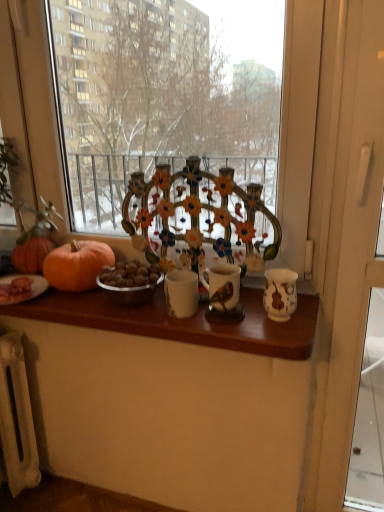
Question: Considering the positions of orange matte pumpkin at left and matte ceramic candle holder at center in the image, is orange matte pumpkin at left taller or shorter than matte ceramic candle holder at center?

Choices:
 (A) short
 (B) tall

Answer: (B)

Question: From the image's perspective, relative to matte ceramic candle holder at center, is orange matte pumpkin at left above or below?

Choices:
 (A) below
 (B) above

Answer: (B)

Question: Estimate the real-world distances between objects in this image. Which object is farther from the matte ceramic candle holder at center?

Choices:
 (A) wooden table at center
 (B) orange matte pumpkin at left
 (C) white plastic screen door at right

Answer: (C)

Question: Estimate the real-world distances between objects in this image. Which object is farther from the wooden table at center?

Choices:
 (A) orange matte pumpkin at left
 (B) matte ceramic candle holder at center
 (C) white plastic screen door at right

Answer: (C)